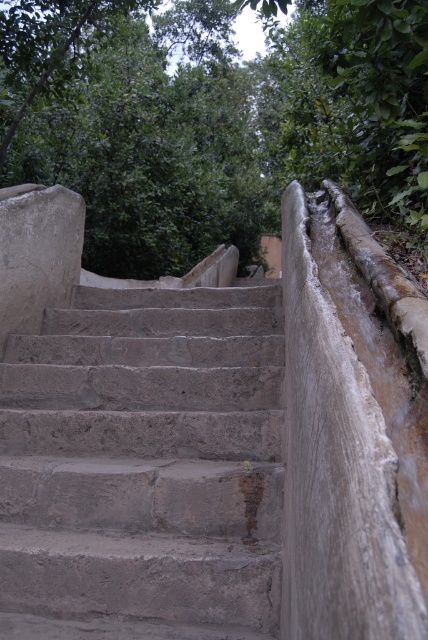
Question: Which of the following is the farthest from the observer?

Choices:
 (A) gray stone stairs at center
 (B) green leafy tree at upper center

Answer: (B)

Question: Which object appears farthest from the camera in this image?

Choices:
 (A) gray stone stairs at center
 (B) green leafy tree at upper center

Answer: (B)

Question: Which of the following is the farthest from the observer?

Choices:
 (A) (152, 104)
 (B) (113, 477)

Answer: (A)

Question: Can you confirm if gray stone stairs at center is positioned below green leafy tree at upper center?

Choices:
 (A) yes
 (B) no

Answer: (A)

Question: Is gray stone stairs at center smaller than green leafy tree at upper center?

Choices:
 (A) no
 (B) yes

Answer: (B)

Question: Is gray stone stairs at center positioned in front of green leafy tree at upper center?

Choices:
 (A) no
 (B) yes

Answer: (B)